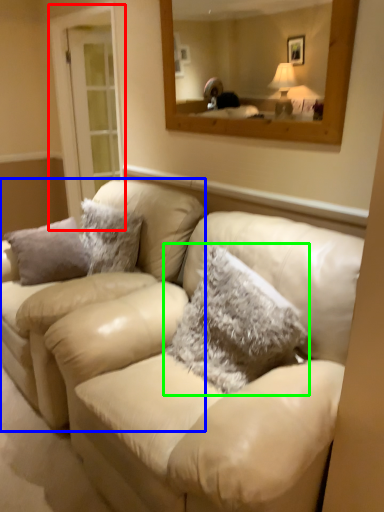
Question: Which object is the farthest from glass door (highlighted by a red box)? Choose among these: couch (highlighted by a blue box) or pillow (highlighted by a green box).

Choices:
 (A) couch
 (B) pillow

Answer: (B)